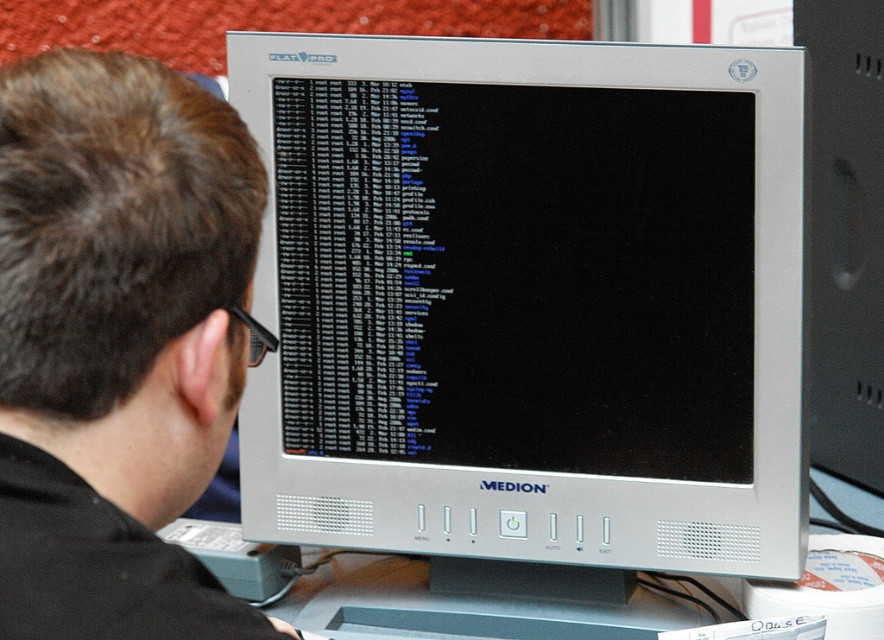
Who is positioned more to the right, silver metallic computer monitor at center or black matte monitor at upper center?

Positioned to the right is silver metallic computer monitor at center.

Is silver metallic computer monitor at center thinner than black matte monitor at upper center?

In fact, silver metallic computer monitor at center might be wider than black matte monitor at upper center.

Find the location of a particular element. This screenshot has width=884, height=640. silver metallic computer monitor at center is located at coordinates (528, 300).

Where is `silver metallic computer monitor at center`? silver metallic computer monitor at center is located at coordinates (528, 300).